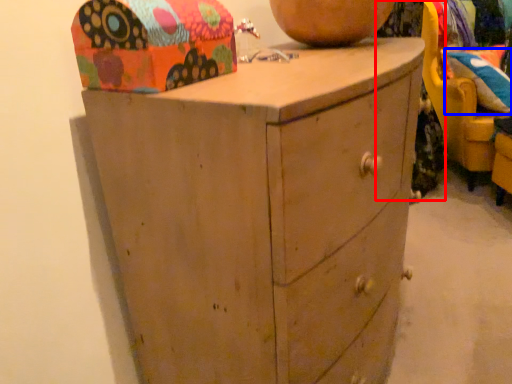
Question: Which point is further to the camera, clothing (highlighted by a red box) or pillow (highlighted by a blue box)?

Choices:
 (A) clothing
 (B) pillow

Answer: (B)